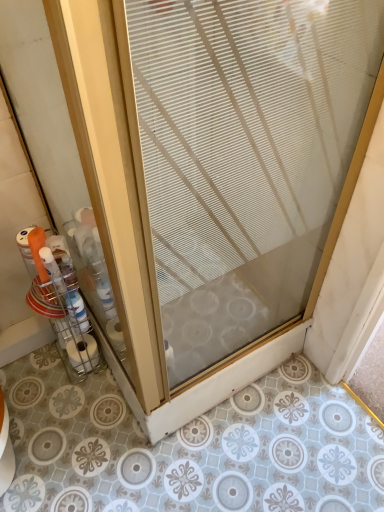
What do you see at coordinates (83, 353) in the screenshot? The height and width of the screenshot is (512, 384). I see `white matte toilet paper at lower left` at bounding box center [83, 353].

Describe the element at coordinates (60, 303) in the screenshot. The image size is (384, 512). I see `clear plastic container at left` at that location.

Based on the photo, in order to face clear plastic container at left, should I rotate leftwards or rightwards?

Turn left by 16.822 degrees to look at clear plastic container at left.

Image resolution: width=384 pixels, height=512 pixels. I want to click on white matte toilet paper at lower left, so click(83, 353).

Considering the positions of objects clear glass door at center and white matte toilet paper at lower left in the image provided, who is more to the left, clear glass door at center or white matte toilet paper at lower left?

From the viewer's perspective, white matte toilet paper at lower left appears more on the left side.

Considering the sizes of clear glass door at center and white matte toilet paper at lower left in the image, is clear glass door at center wider or thinner than white matte toilet paper at lower left?

clear glass door at center is wider than white matte toilet paper at lower left.

You are a GUI agent. You are given a task and a screenshot of the screen. Output one action in this format:
    pyautogui.click(x=<x>, y=<y>)
    Task: Click on the door above the white matte toilet paper at lower left (from a real-world perspective)
    The width and height of the screenshot is (384, 512).
    Given the screenshot: What is the action you would take?
    pyautogui.click(x=243, y=157)

Is point (159, 123) closer or farther from the camera than point (84, 364)?

Point (159, 123) is closer to the camera than point (84, 364).

Considering the positions of points (221, 185) and (67, 341), is point (221, 185) closer to camera compared to point (67, 341)?

Yes, it is.

Based on the photo, in terms of width, does clear glass door at center look wider or thinner when compared to clear plastic container at left?

In the image, clear glass door at center appears to be wider than clear plastic container at left.

Image resolution: width=384 pixels, height=512 pixels. What are the coordinates of `door lying on the right of clear plastic container at left` in the screenshot? It's located at (243, 157).

What's the angular difference between clear glass door at center and clear plastic container at left's facing directions?

The angle between the facing direction of clear glass door at center and the facing direction of clear plastic container at left is 92.4 degrees.

Considering the relative sizes of clear plastic container at left and clear glass door at center in the image provided, is clear plastic container at left bigger than clear glass door at center?

Incorrect, clear plastic container at left is not larger than clear glass door at center.

Is clear plastic container at left wider or thinner than clear glass door at center?

clear plastic container at left is thinner than clear glass door at center.

Is clear plastic container at left placed right next to clear glass door at center?

clear plastic container at left and clear glass door at center are clearly separated.

Is clear plastic container at left aimed at clear glass door at center?

No.

Is white matte toilet paper at lower left in contact with clear glass door at center?

No, white matte toilet paper at lower left is not touching clear glass door at center.

Is white matte toilet paper at lower left taller than clear glass door at center?

No, white matte toilet paper at lower left is not taller than clear glass door at center.

Which is behind, point (83, 348) or point (180, 190)?

The point (83, 348) is farther from the camera.

Can you confirm if clear plastic container at left is positioned to the right of white matte toilet paper at lower left?

In fact, clear plastic container at left is to the left of white matte toilet paper at lower left.

Where is `toilet paper below the clear plastic container at left (from a real-world perspective)`? The width and height of the screenshot is (384, 512). toilet paper below the clear plastic container at left (from a real-world perspective) is located at coordinates (83, 353).

Is clear plastic container at left taller or shorter than white matte toilet paper at lower left?

clear plastic container at left is taller than white matte toilet paper at lower left.

Is clear plastic container at left positioned beyond the bounds of white matte toilet paper at lower left?

Indeed, clear plastic container at left is completely outside white matte toilet paper at lower left.

From a real-world perspective, which object stands above the other?

clear plastic container at left, from a real-world perspective.

Between white matte toilet paper at lower left and clear plastic container at left, which one appears on the left side from the viewer's perspective?

From the viewer's perspective, clear plastic container at left appears more on the left side.

Which object is further away from the camera, white matte toilet paper at lower left or clear plastic container at left?

white matte toilet paper at lower left is further from the camera.

In order to click on toilet paper that is below the clear glass door at center (from the image's perspective) in this screenshot , I will do `click(83, 353)`.

The width and height of the screenshot is (384, 512). Identify the location of door that is above the clear plastic container at left (from a real-world perspective). (243, 157).

Estimate the real-world distances between objects in this image. Which object is further from white matte toilet paper at lower left, clear plastic container at left or clear glass door at center?

Among the two, clear glass door at center is located further to white matte toilet paper at lower left.

When comparing their distances from clear plastic container at left, does white matte toilet paper at lower left or clear glass door at center seem closer?

white matte toilet paper at lower left lies closer to clear plastic container at left than the other object.

Estimate the real-world distances between objects in this image. Which object is further from clear plastic container at left, clear glass door at center or white matte toilet paper at lower left?

A: Among the two, clear glass door at center is located further to clear plastic container at left.

Looking at the image, which one is located closer to white matte toilet paper at lower left, clear glass door at center or clear plastic container at left?

clear plastic container at left is closer to white matte toilet paper at lower left.

Estimate the real-world distances between objects in this image. Which object is further from clear glass door at center, white matte toilet paper at lower left or clear plastic container at left?

white matte toilet paper at lower left.

From the image, which object appears to be farther from clear glass door at center, clear plastic container at left or white matte toilet paper at lower left?

white matte toilet paper at lower left lies further to clear glass door at center than the other object.

Find the location of a particular element. glass box between clear glass door at center and white matte toilet paper at lower left from front to back is located at coordinates (60, 303).